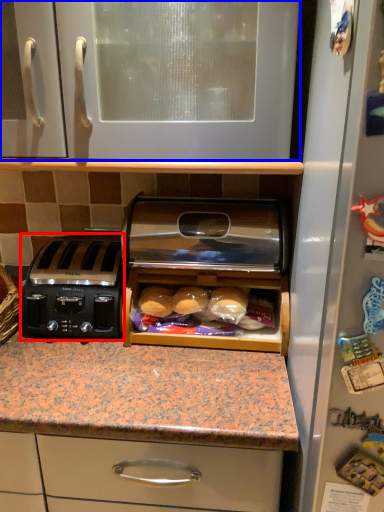
Question: Among these objects, which one is nearest to the camera, toaster (highlighted by a red box) or cabinetry (highlighted by a blue box)?

Choices:
 (A) toaster
 (B) cabinetry

Answer: (B)